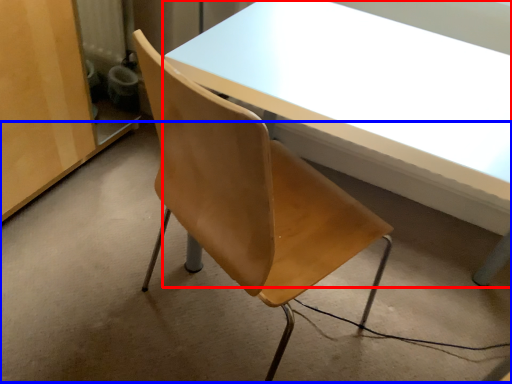
Question: Which point is closer to the camera, table (highlighted by a red box) or concrete (highlighted by a blue box)?

Choices:
 (A) table
 (B) concrete

Answer: (A)